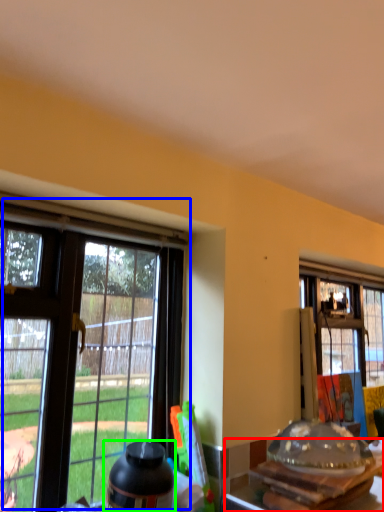
Question: Based on their relative distances, which object is farther from kitchen & dining room table (highlighted by a red box)? Choose from window (highlighted by a blue box) and bottle (highlighted by a green box).

Choices:
 (A) window
 (B) bottle

Answer: (A)